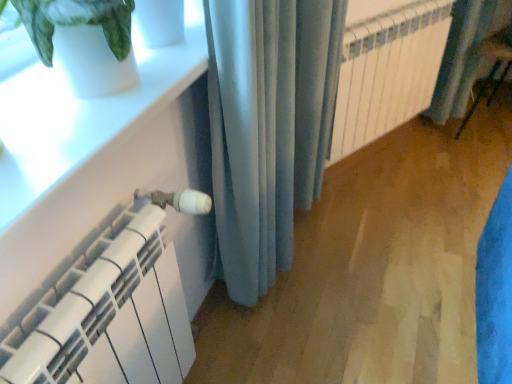
Where is `free space above white metallic radiator at center (from a real-world perspective)`? This screenshot has width=512, height=384. free space above white metallic radiator at center (from a real-world perspective) is located at coordinates (392, 14).